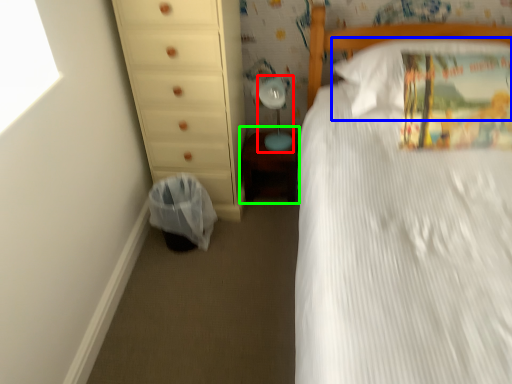
Question: Which is nearer to the table lamp (highlighted by a red box)? pillow (highlighted by a blue box) or changing table (highlighted by a green box).

Choices:
 (A) pillow
 (B) changing table

Answer: (B)